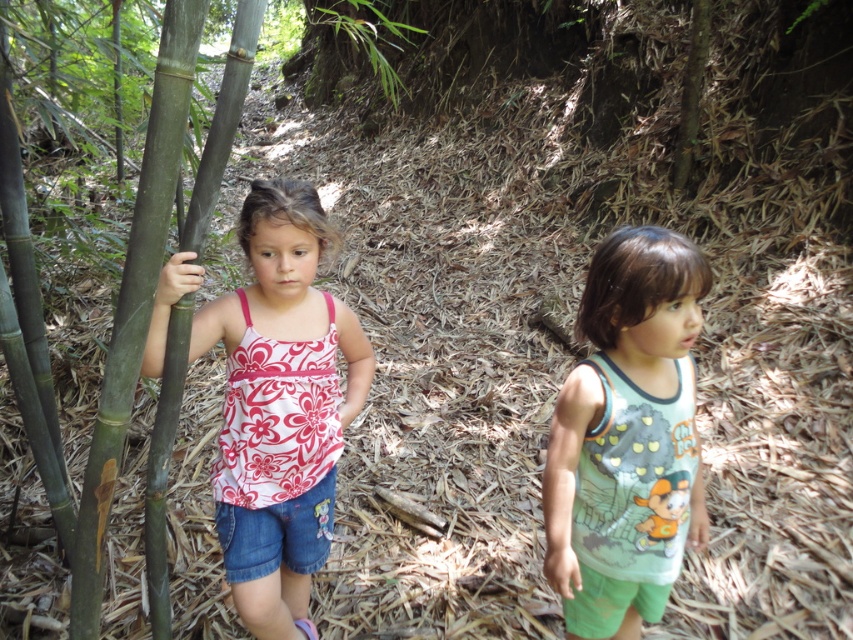
You are a photographer trying to capture both the green cotton tank top at center and the green smooth bamboo at left in a single frame. Based on their positions, which object should you focus on first to ensure both are in focus?

The green smooth bamboo at left is behind the green cotton tank top at center, so you should focus on the green cotton tank top at center first to ensure both are in focus.